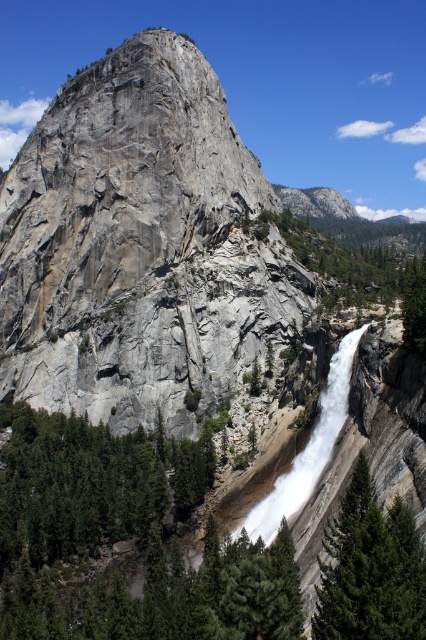
You are a hiker standing at the base of the cliff and want to take a photo of both the green matte tree at lower left and the green textured tree at lower right. Which tree should you position closer to the camera to ensure both fit in the frame?

The green matte tree at lower left is wider than the green textured tree at lower right. To ensure both fit in the frame, position the green matte tree at lower left closer to the camera since its greater width requires more space in the photo.

You are a hiker standing at the base of the cliff. You see the white frothy water at center and the green leafy tree at right. Which object is higher up on the cliff?

The green leafy tree at right is higher up on the cliff because the white frothy water at center is below it.